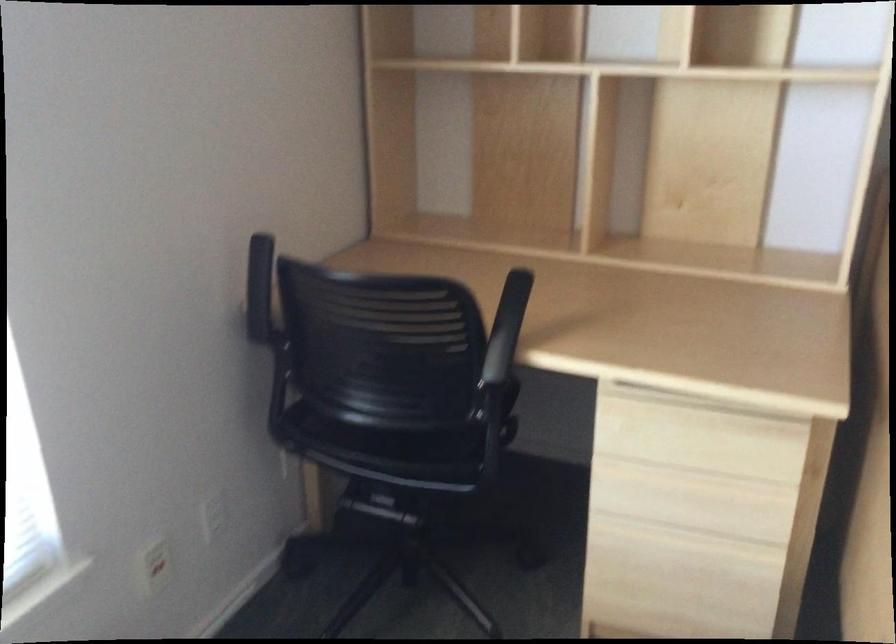
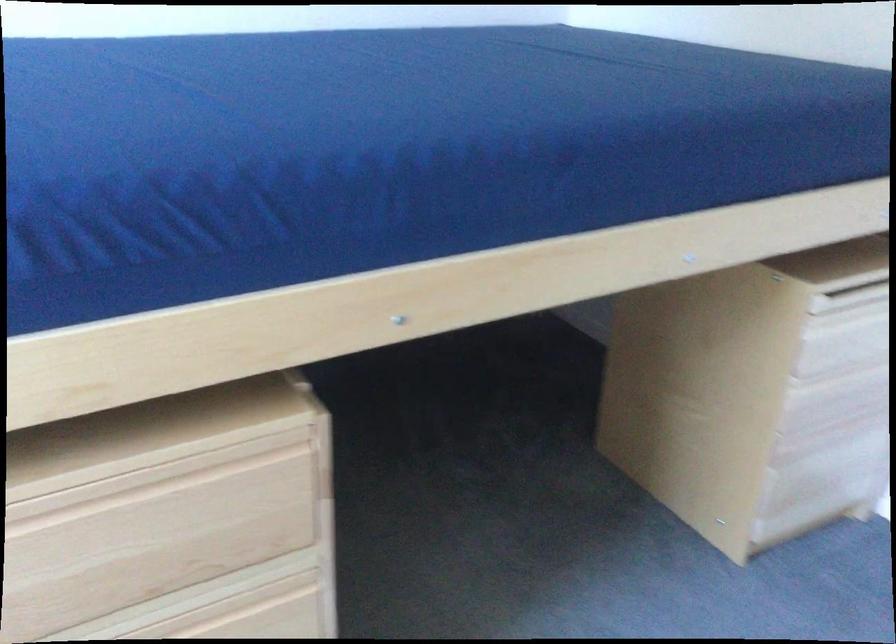
Question: Based on the continuous images, in which direction is the camera rotating? Reply with the corresponding letter.

Choices:
 (A) Left
 (B) Right
 (C) Up
 (D) Down

Answer: (B)